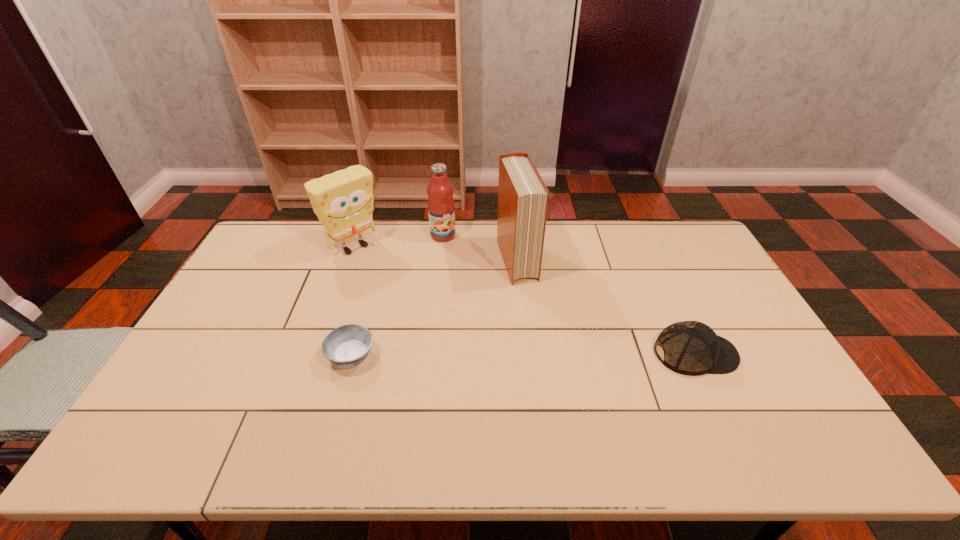
What are the coordinates of `the shortest object` in the screenshot? It's located at (347, 346).

Locate an element on the screen. The image size is (960, 540). the rightmost object is located at coordinates (692, 348).

Where is `cap`? The image size is (960, 540). cap is located at coordinates (692, 348).

You are a GUI agent. You are given a task and a screenshot of the screen. Output one action in this format:
    pyautogui.click(x=<x>, y=<y>)
    Task: Click on the fourth object from left to right
    The image size is (960, 540).
    Given the screenshot: What is the action you would take?
    pyautogui.click(x=523, y=197)

Where is `the tallest object`? This screenshot has height=540, width=960. the tallest object is located at coordinates (523, 197).

Find the location of a particular element. This screenshot has width=960, height=540. fruit juice is located at coordinates (441, 209).

This screenshot has width=960, height=540. I want to click on sponge, so click(x=343, y=201).

This screenshot has height=540, width=960. In order to click on free space located 0.300m on the back of the ashtray in this screenshot , I will do `click(375, 271)`.

At what (x,y) coordinates should I click in order to perform the action: click on free location located on the front-facing side of the second shortest object. Please return your answer as a coordinate pair (x, y). The image size is (960, 540). Looking at the image, I should click on (769, 354).

The width and height of the screenshot is (960, 540). Find the location of `vacant space located on the open cover of the tallest object`. vacant space located on the open cover of the tallest object is located at coordinates (538, 326).